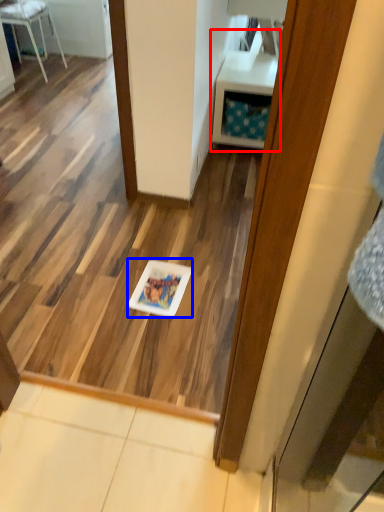
Question: Which of the following is the farthest to the observer, vanity (highlighted by a red box) or glass plate (highlighted by a blue box)?

Choices:
 (A) vanity
 (B) glass plate

Answer: (A)